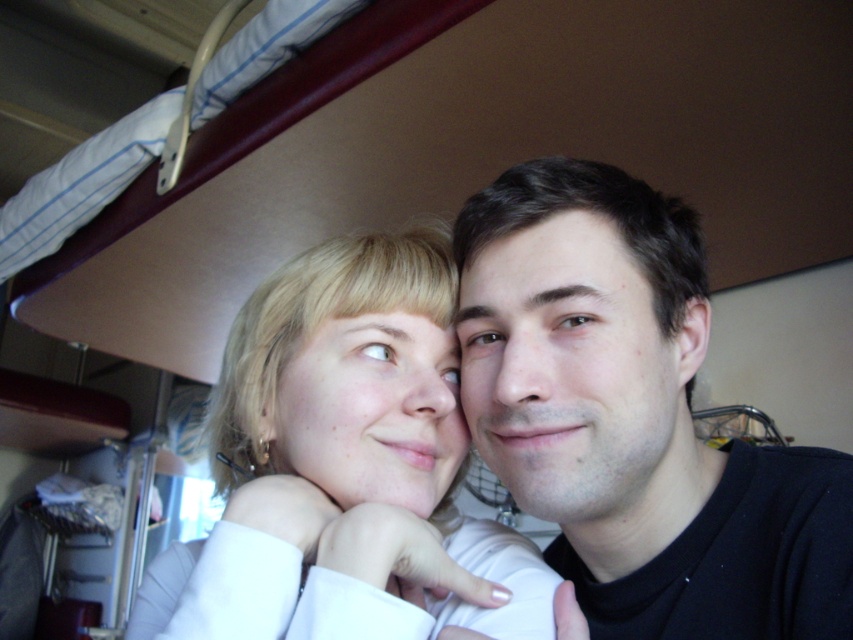
Question: Which point appears farthest from the camera in this image?

Choices:
 (A) (646, 256)
 (B) (462, 433)

Answer: (B)

Question: Which object is closer to the camera taking this photo?

Choices:
 (A) smooth skin face at center
 (B) blonde hair at center

Answer: (B)

Question: Which point appears closest to the camera in this image?

Choices:
 (A) (251, 394)
 (B) (593, 508)

Answer: (B)

Question: Is smooth skin face at center thinner than blonde hair at center?

Choices:
 (A) no
 (B) yes

Answer: (A)

Question: Can you confirm if smooth skin face at center is wider than blonde hair at center?

Choices:
 (A) yes
 (B) no

Answer: (A)

Question: Can you confirm if smooth skin face at center is positioned to the right of blonde hair at center?

Choices:
 (A) yes
 (B) no

Answer: (A)